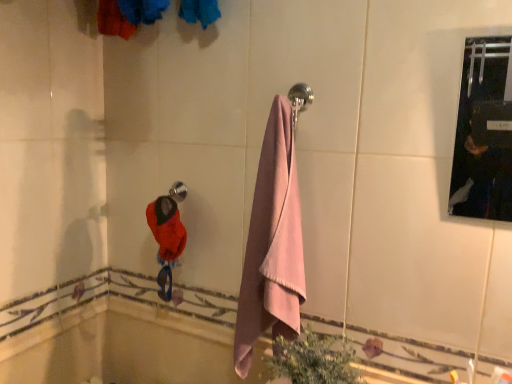
Image resolution: width=512 pixels, height=384 pixels. Describe the element at coordinates (272, 244) in the screenshot. I see `pink cotton towel at center` at that location.

Locate an element on the screen. This screenshot has height=384, width=512. pink cotton towel at center is located at coordinates (272, 244).

Locate an element on the screen. polished chrome towel bar at upper center is located at coordinates (178, 191).

Is point (129, 11) in front of point (275, 365)?

No, it is not.

Is soft blue fabric at upper center not inside green leafy plant at lower center?

Yes, soft blue fabric at upper center is outside of green leafy plant at lower center.

Would you say soft blue fabric at upper center is a long distance from green leafy plant at lower center?

soft blue fabric at upper center is actually quite close to green leafy plant at lower center.

Would you say pink cotton towel at center is part of polished chrome towel bar at upper center's contents?

No, pink cotton towel at center is not surrounded by polished chrome towel bar at upper center.

Who is smaller, polished chrome towel bar at upper center or pink cotton towel at center?

polished chrome towel bar at upper center is smaller.

From their relative heights in the image, would you say polished chrome towel bar at upper center is taller or shorter than pink cotton towel at center?

Clearly, polished chrome towel bar at upper center is shorter compared to pink cotton towel at center.

Between soft blue fabric at upper center and pink cotton towel at center, which one has larger size?

With larger size is pink cotton towel at center.

Can you tell me how much soft blue fabric at upper center and pink cotton towel at center differ in facing direction?

soft blue fabric at upper center and pink cotton towel at center are facing 90.5 degrees away from each other.

Is pink cotton towel at center at the back of soft blue fabric at upper center?

No, soft blue fabric at upper center is not facing away from pink cotton towel at center.

Does polished chrome towel bar at upper center have a greater height compared to soft blue fabric at upper center?

In fact, polished chrome towel bar at upper center may be shorter than soft blue fabric at upper center.

From the image's perspective, which one is positioned higher, polished chrome towel bar at upper center or soft blue fabric at upper center?

soft blue fabric at upper center.

Based on the photo, is polished chrome towel bar at upper center oriented away from soft blue fabric at upper center?

No, polished chrome towel bar at upper center is not facing the opposite direction of soft blue fabric at upper center.

In terms of width, does polished chrome towel bar at upper center look wider or thinner when compared to soft blue fabric at upper center?

Considering their sizes, polished chrome towel bar at upper center looks slimmer than soft blue fabric at upper center.

Considering the positions of point (287, 305) and point (349, 375), is point (287, 305) closer or farther from the camera than point (349, 375)?

Clearly, point (287, 305) is more distant from the camera than point (349, 375).

Locate an element on the screen. This screenshot has height=384, width=512. plant below the pink cotton towel at center (from the image's perspective) is located at coordinates (312, 359).

Is pink cotton towel at center oriented towards green leafy plant at lower center?

No, pink cotton towel at center is not oriented towards green leafy plant at lower center.

Considering their positions, is pink cotton towel at center located in front of or behind green leafy plant at lower center?

Visually, pink cotton towel at center is located behind green leafy plant at lower center.

Which is further, [212,17] or [183,193]?

Point [183,193]

From the image's perspective, is soft blue fabric at upper center above polished chrome towel bar at upper center?

Yes, from the image's perspective, soft blue fabric at upper center is above polished chrome towel bar at upper center.

You are a GUI agent. You are given a task and a screenshot of the screen. Output one action in this format:
    pyautogui.click(x=<x>, y=<y>)
    Task: Click on the towel bar directly beneath the soft blue fabric at upper center (from a real-world perspective)
    
    Given the screenshot: What is the action you would take?
    point(178,191)

Is soft blue fabric at upper center not close to polished chrome towel bar at upper center?

soft blue fabric at upper center is near polished chrome towel bar at upper center, not far away.

In the scene shown: Could you tell me if green leafy plant at lower center is facing polished chrome towel bar at upper center?

No, green leafy plant at lower center is not facing towards polished chrome towel bar at upper center.

Is polished chrome towel bar at upper center surrounded by green leafy plant at lower center?

Definitely not — polished chrome towel bar at upper center is not inside green leafy plant at lower center.

Are green leafy plant at lower center and polished chrome towel bar at upper center located far from each other?

No, green leafy plant at lower center is not far away from polished chrome towel bar at upper center.

Image resolution: width=512 pixels, height=384 pixels. I want to click on plant behind the soft blue fabric at upper center, so click(x=312, y=359).

This screenshot has height=384, width=512. I want to click on towel bar that appears above the pink cotton towel at center (from the image's perspective), so [x=178, y=191].

Based on their spatial positions, is pink cotton towel at center or polished chrome towel bar at upper center further from green leafy plant at lower center?

The object further to green leafy plant at lower center is polished chrome towel bar at upper center.

Estimate the real-world distances between objects in this image. Which object is further from polished chrome towel bar at upper center, green leafy plant at lower center or soft blue fabric at upper center?

green leafy plant at lower center is further to polished chrome towel bar at upper center.

When comparing their distances from soft blue fabric at upper center, does green leafy plant at lower center or pink cotton towel at center seem closer?

Among the two, pink cotton towel at center is located nearer to soft blue fabric at upper center.

Which object lies nearer to the anchor point soft blue fabric at upper center, pink cotton towel at center or polished chrome towel bar at upper center?

Among the two, polished chrome towel bar at upper center is located nearer to soft blue fabric at upper center.

Which object lies nearer to the anchor point pink cotton towel at center, soft blue fabric at upper center or polished chrome towel bar at upper center?

The object closer to pink cotton towel at center is polished chrome towel bar at upper center.

When comparing their distances from pink cotton towel at center, does polished chrome towel bar at upper center or green leafy plant at lower center seem further?

polished chrome towel bar at upper center lies further to pink cotton towel at center than the other object.

Consider the image. Looking at the image, which one is located closer to pink cotton towel at center, polished chrome towel bar at upper center or soft blue fabric at upper center?

polished chrome towel bar at upper center is closer to pink cotton towel at center.

From the image, which object appears to be farther from pink cotton towel at center, soft blue fabric at upper center or green leafy plant at lower center?

soft blue fabric at upper center.

This screenshot has width=512, height=384. What are the coordinates of `towel bar between soft blue fabric at upper center and pink cotton towel at center from top to bottom` in the screenshot? It's located at (178, 191).

What are the coordinates of `towel bar between soft blue fabric at upper center and green leafy plant at lower center vertically` in the screenshot? It's located at (178, 191).

Where is `towel between soft blue fabric at upper center and green leafy plant at lower center in the vertical direction`? The image size is (512, 384). towel between soft blue fabric at upper center and green leafy plant at lower center in the vertical direction is located at coordinates (272, 244).

Locate an element on the screen. towel between green leafy plant at lower center and polished chrome towel bar at upper center in the front-back direction is located at coordinates (272, 244).